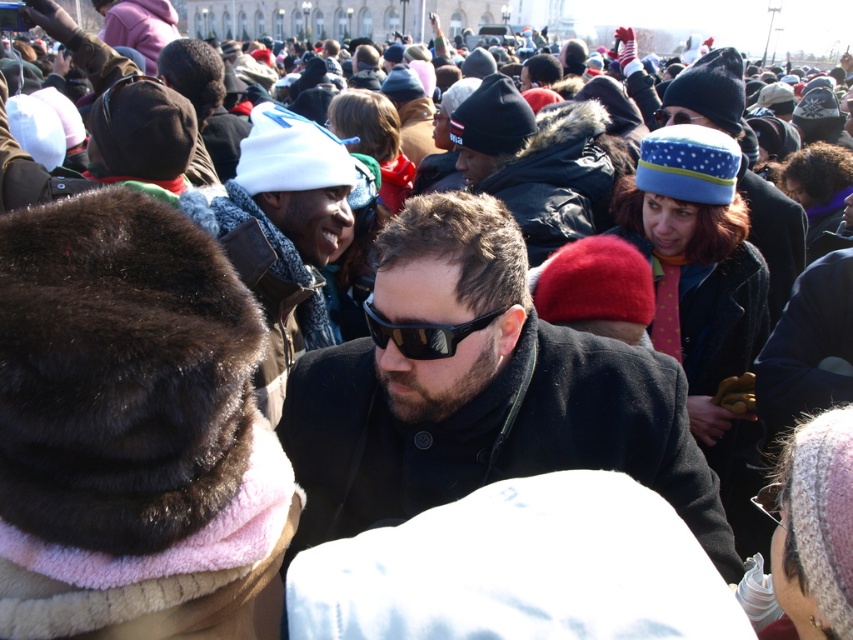
Is white knit hat at upper center further to the viewer compared to black reflective sunglasses at center?

That is True.

Can you confirm if white knit hat at upper center is thinner than black reflective sunglasses at center?

In fact, white knit hat at upper center might be wider than black reflective sunglasses at center.

Does point (242, 264) come behind point (375, 321)?

That is True.

Locate an element on the screen. The height and width of the screenshot is (640, 853). white knit hat at upper center is located at coordinates (281, 232).

Is black matte coat at center behind white knit hat at upper center?

No, black matte coat at center is closer to the viewer.

Does point (660, 401) come in front of point (285, 353)?

Yes, point (660, 401) is in front of point (285, 353).

At what (x,y) coordinates should I click in order to perform the action: click on black matte coat at center. Please return your answer as a coordinate pair (x, y). This screenshot has width=853, height=640. Looking at the image, I should click on (479, 390).

Does black matte coat at center have a smaller size compared to black reflective sunglasses at center?

Incorrect, black matte coat at center is not smaller in size than black reflective sunglasses at center.

Is point (440, 493) positioned behind point (415, 353)?

Yes, it is.

Between point (368, 502) and point (370, 304), which one is positioned behind?

The point (370, 304) is more distant.

At what (x,y) coordinates should I click in order to perform the action: click on black matte coat at center. Please return your answer as a coordinate pair (x, y). The image size is (853, 640). Looking at the image, I should click on (479, 390).